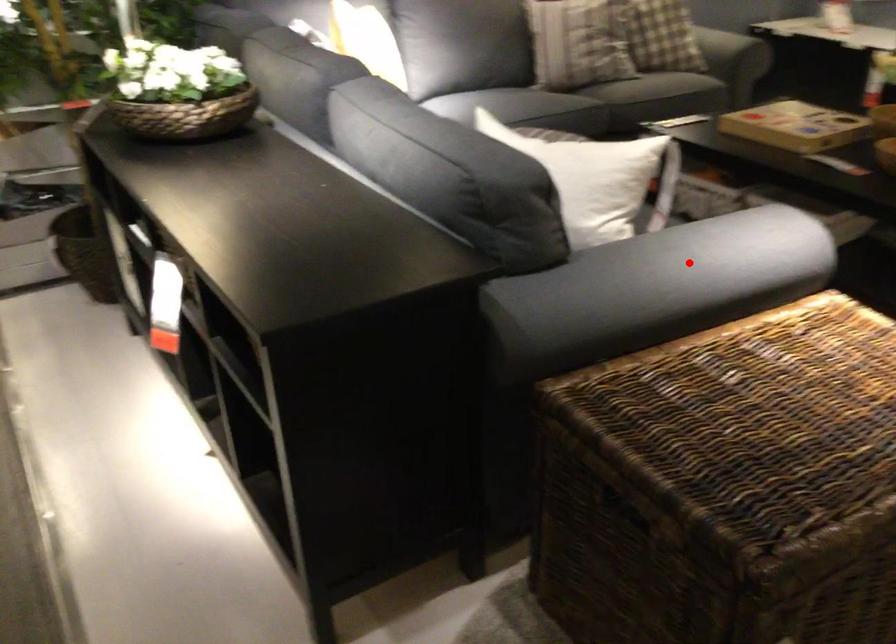
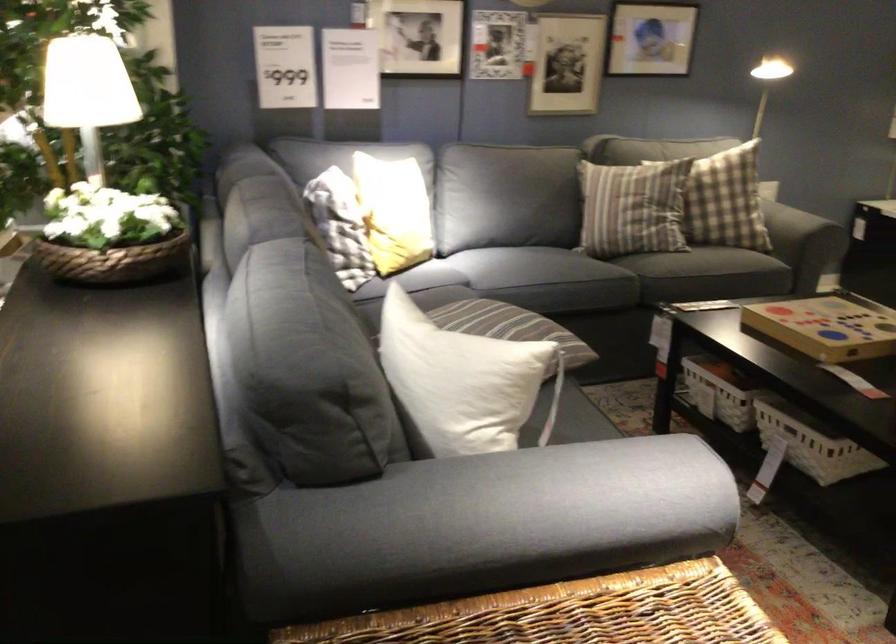
In the second image, find the point that corresponds to the highlighted location in the first image.

(528, 500)